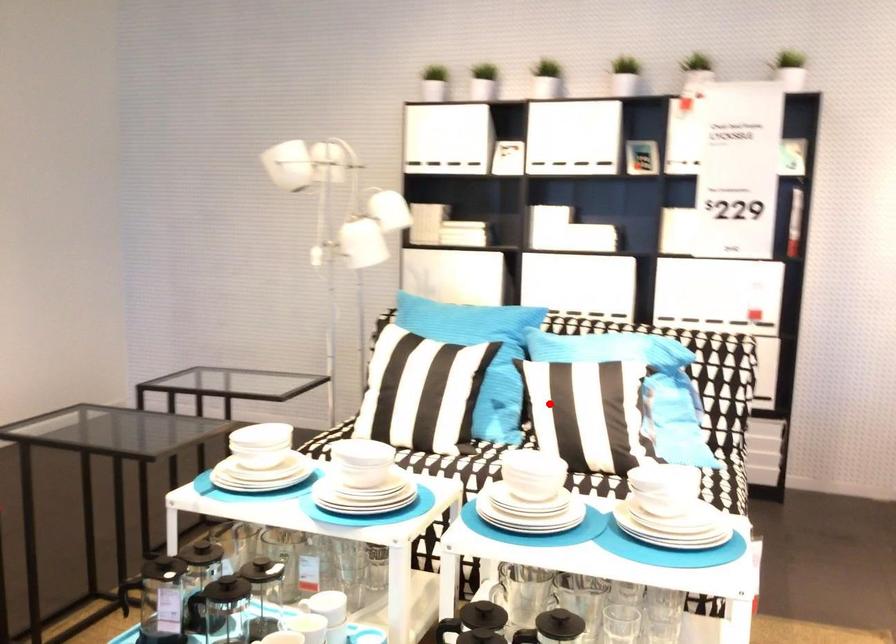
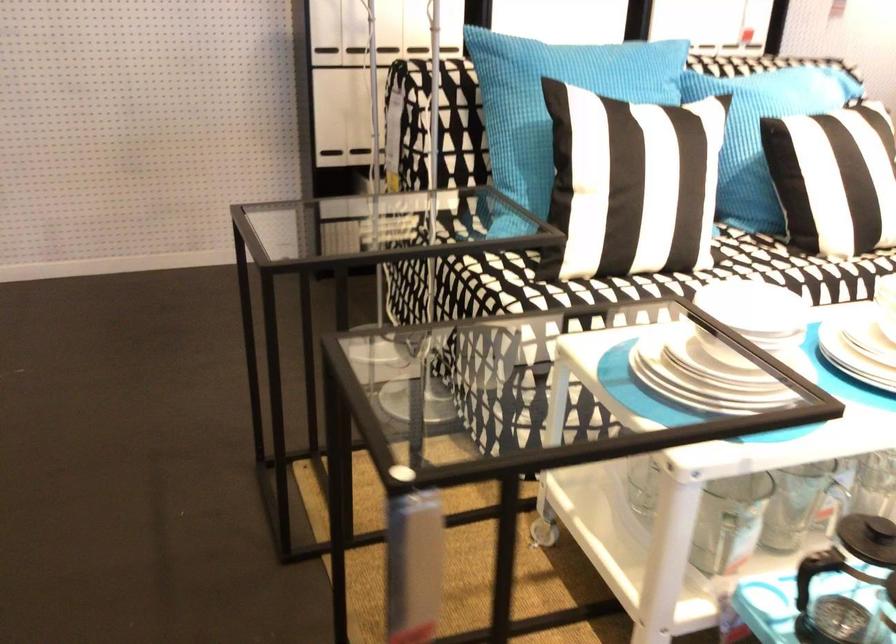
Question: I am providing you with two images of the same scene from different viewpoints. Image1 has a red point marked. In image2, the corresponding 3D location appears at what relative position? Reply with the corresponding letter.

Choices:
 (A) Closer
 (B) Farther

Answer: (A)